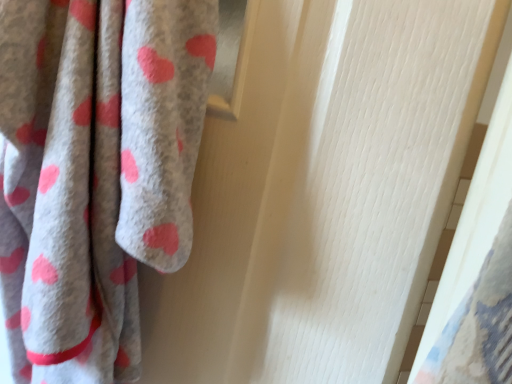
What do you see at coordinates (95, 172) in the screenshot?
I see `fluffy gray towel with pink hearts at left` at bounding box center [95, 172].

Locate an element on the screen. Image resolution: width=512 pixels, height=384 pixels. fluffy gray towel with pink hearts at left is located at coordinates (95, 172).

The height and width of the screenshot is (384, 512). I want to click on fluffy gray towel with pink hearts at left, so click(x=95, y=172).